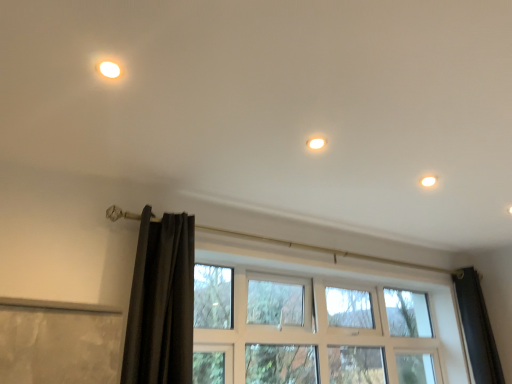
You are a GUI agent. You are given a task and a screenshot of the screen. Output one action in this format:
    pyautogui.click(x=<x>, y=<y>)
    Task: Click on the clear glass window at center
    
    Given the screenshot: What is the action you would take?
    point(327,324)

What do you see at coordinates (109, 69) in the screenshot?
I see `matte white light at upper left` at bounding box center [109, 69].

What are the coordinates of `white glossy light fixture at upper right` in the screenshot? It's located at (428, 181).

The image size is (512, 384). I want to click on clear glass window at center, so click(327, 324).

Considering the positions of objects clear glass window at center and black velvet curtain at left in the image provided, who is more to the right, clear glass window at center or black velvet curtain at left?

clear glass window at center is more to the right.

Is clear glass window at center looking in the opposite direction of black velvet curtain at left?

clear glass window at center does not have its back to black velvet curtain at left.

Considering the sizes of objects clear glass window at center and black velvet curtain at left in the image provided, who is shorter, clear glass window at center or black velvet curtain at left?

Standing shorter between the two is black velvet curtain at left.

From the picture: Considering the sizes of objects clear glass window at center and white glossy light fixture at upper right in the image provided, who is shorter, clear glass window at center or white glossy light fixture at upper right?

With less height is white glossy light fixture at upper right.

Is clear glass window at center positioned with its back to white glossy light fixture at upper right?

That's not correct — clear glass window at center is not looking away from white glossy light fixture at upper right.

Considering the relative positions of clear glass window at center and white glossy light fixture at upper right in the image provided, is clear glass window at center in front of white glossy light fixture at upper right?

Yes, clear glass window at center is closer to the camera.

How much distance is there between clear glass window at center and white glossy light fixture at upper right?

They are 1.27 meters apart.

Is white glossy light fixture at upper right next to clear glass window at center and touching it?

They are not placed beside each other.

Is white glossy light fixture at upper right aimed at clear glass window at center?

No, white glossy light fixture at upper right is not turned towards clear glass window at center.

From the image's perspective, does white glossy light fixture at upper right appear higher than clear glass window at center?

Yes, from the image's perspective, white glossy light fixture at upper right is above clear glass window at center.

Does black velvet curtain at left touch white glossy light fixture at upper right?

They are not placed beside each other.

Does black velvet curtain at left have a lesser width compared to white glossy light fixture at upper right?

Incorrect, the width of black velvet curtain at left is not less than that of white glossy light fixture at upper right.

Is the position of black velvet curtain at left more distant than that of white glossy light fixture at upper right?

No.

Is black velvet curtain at left facing towards white glossy light fixture at upper right?

No, black velvet curtain at left does not turn towards white glossy light fixture at upper right.

Consider the image. Is black velvet curtain at left inside matte white light at upper left?

No, matte white light at upper left does not contain black velvet curtain at left.

Measure the distance from matte white light at upper left to black velvet curtain at left.

matte white light at upper left and black velvet curtain at left are 3.29 feet apart from each other.

Does matte white light at upper left have a smaller size compared to black velvet curtain at left?

Correct, matte white light at upper left occupies less space than black velvet curtain at left.

The image size is (512, 384). In order to click on curtain on the right of the matte white light at upper left in this screenshot , I will do `click(161, 303)`.

Is black velvet curtain at left spatially inside matte white light at upper left, or outside of it?

black velvet curtain at left is outside matte white light at upper left.

Can you confirm if black velvet curtain at left is taller than matte white light at upper left?

Indeed, black velvet curtain at left has a greater height compared to matte white light at upper left.

Consider the image. Is black velvet curtain at left positioned far away from matte white light at upper left?

Absolutely, black velvet curtain at left is distant from matte white light at upper left.

From the image's perspective, which one is positioned higher, black velvet curtain at left or matte white light at upper left?

matte white light at upper left.

In order to click on light above the clear glass window at center (from a real-world perspective) in this screenshot , I will do `click(109, 69)`.

Does point (357, 277) appear closer or farther from the camera than point (120, 76)?

Point (357, 277) appears to be farther away from the viewer than point (120, 76).

Could matte white light at upper left be considered to be inside clear glass window at center?

No, matte white light at upper left is not inside clear glass window at center.

Where is `window directly beneath the black velvet curtain at left (from a real-world perspective)`? window directly beneath the black velvet curtain at left (from a real-world perspective) is located at coordinates (327, 324).

You are a GUI agent. You are given a task and a screenshot of the screen. Output one action in this format:
    pyautogui.click(x=<x>, y=<y>)
    Task: Click on the dot that is on the right side of clear glass window at center
    This screenshot has height=384, width=512.
    Given the screenshot: What is the action you would take?
    pyautogui.click(x=428, y=181)

When comparing their distances from black velvet curtain at left, does matte white light at upper left or clear glass window at center seem closer?

clear glass window at center.

Looking at the image, which one is located closer to clear glass window at center, white glossy light fixture at upper right or black velvet curtain at left?

Based on the image, black velvet curtain at left appears to be nearer to clear glass window at center.

Based on their spatial positions, is black velvet curtain at left or white glossy light fixture at upper right further from matte white light at upper left?

The object further to matte white light at upper left is white glossy light fixture at upper right.

Estimate the real-world distances between objects in this image. Which object is closer to black velvet curtain at left, white glossy light fixture at upper right or clear glass window at center?

Based on the image, clear glass window at center appears to be nearer to black velvet curtain at left.

Estimate the real-world distances between objects in this image. Which object is closer to white glossy light fixture at upper right, black velvet curtain at left or clear glass window at center?

clear glass window at center lies closer to white glossy light fixture at upper right than the other object.

Estimate the real-world distances between objects in this image. Which object is further from matte white light at upper left, black velvet curtain at left or clear glass window at center?

The object further to matte white light at upper left is clear glass window at center.

From the picture: Which object lies nearer to the anchor point matte white light at upper left, clear glass window at center or white glossy light fixture at upper right?

white glossy light fixture at upper right is positioned closer to the anchor matte white light at upper left.

Which object lies nearer to the anchor point clear glass window at center, matte white light at upper left or black velvet curtain at left?

black velvet curtain at left is positioned closer to the anchor clear glass window at center.

Locate an element on the screen. The height and width of the screenshot is (384, 512). curtain between matte white light at upper left and clear glass window at center in the vertical direction is located at coordinates (161, 303).

In order to click on curtain between matte white light at upper left and white glossy light fixture at upper right from left to right in this screenshot , I will do `click(161, 303)`.

In order to click on window between black velvet curtain at left and white glossy light fixture at upper right in this screenshot , I will do `click(327, 324)`.

Image resolution: width=512 pixels, height=384 pixels. I want to click on window between matte white light at upper left and white glossy light fixture at upper right from left to right, so click(327, 324).